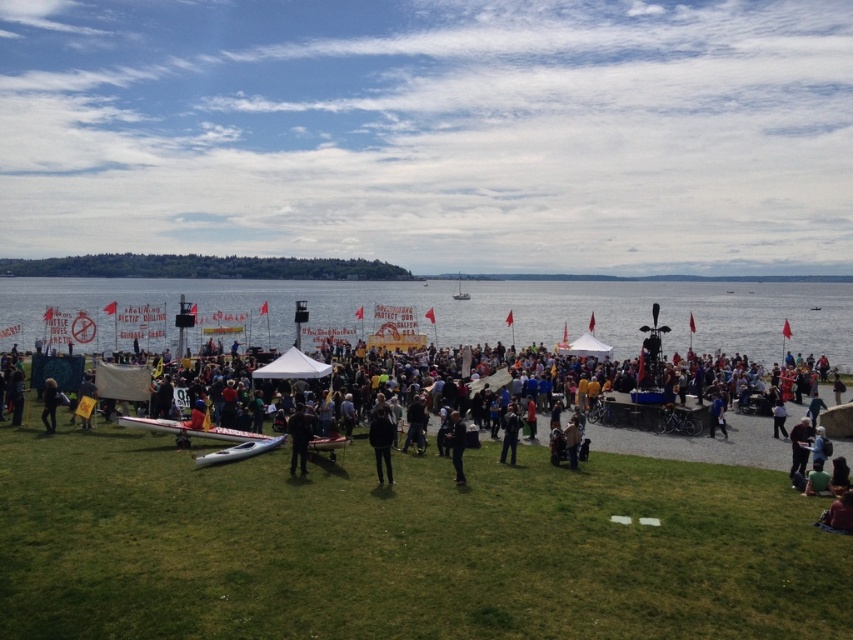
Who is more forward, (x=374, y=451) or (x=795, y=449)?

Point (x=374, y=451)

Who is positioned more to the right, black matte jacket at center or dark blue jeans at lower right?

dark blue jeans at lower right

At what (x,y) coordinates should I click in order to perform the action: click on black matte jacket at center. Please return your answer as a coordinate pair (x, y). This screenshot has width=853, height=640. Looking at the image, I should click on (381, 442).

Consider the image. Can you confirm if green grass at lower left is thinner than dark gray fabric jacket at center?

Incorrect, green grass at lower left's width is not less than dark gray fabric jacket at center's.

Between point (834, 580) and point (421, 419), which one is positioned behind?

The point (421, 419) is more distant.

Which is in front, point (178, 573) or point (421, 416)?

Positioned in front is point (178, 573).

You are a GUI agent. You are given a task and a screenshot of the screen. Output one action in this format:
    pyautogui.click(x=<x>, y=<y>)
    Task: Click on the green grass at lower left
    The width and height of the screenshot is (853, 640).
    Given the screenshot: What is the action you would take?
    pyautogui.click(x=403, y=547)

Can you confirm if black matte jacket at center is taller than white matte sailboat at center?

No.

The image size is (853, 640). Identify the location of black matte jacket at center. (381, 442).